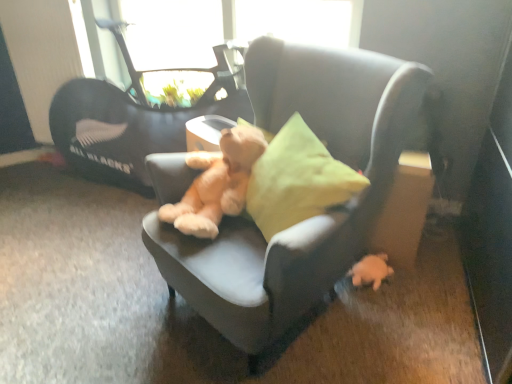
Question: Is the depth of soft beige teddy bear at center less than that of transparent glass window screen at upper center?

Choices:
 (A) no
 (B) yes

Answer: (B)

Question: Considering the relative positions of soft beige teddy bear at center and transparent glass window screen at upper center in the image provided, is soft beige teddy bear at center to the left of transparent glass window screen at upper center from the viewer's perspective?

Choices:
 (A) yes
 (B) no

Answer: (A)

Question: Can you confirm if soft beige teddy bear at center is thinner than transparent glass window screen at upper center?

Choices:
 (A) yes
 (B) no

Answer: (B)

Question: Does soft beige teddy bear at center have a smaller size compared to transparent glass window screen at upper center?

Choices:
 (A) no
 (B) yes

Answer: (B)

Question: Considering the relative positions of soft beige teddy bear at center and transparent glass window screen at upper center in the image provided, is soft beige teddy bear at center to the right of transparent glass window screen at upper center from the viewer's perspective?

Choices:
 (A) no
 (B) yes

Answer: (A)

Question: From a real-world perspective, relative to transparent glass window screen at upper center, is soft gray chair at center vertically above or below?

Choices:
 (A) below
 (B) above

Answer: (A)

Question: Is soft gray chair at center inside the boundaries of transparent glass window screen at upper center, or outside?

Choices:
 (A) inside
 (B) outside

Answer: (B)

Question: Is soft gray chair at center taller or shorter than transparent glass window screen at upper center?

Choices:
 (A) short
 (B) tall

Answer: (B)

Question: Is point (327, 269) closer or farther from the camera than point (184, 48)?

Choices:
 (A) closer
 (B) farther

Answer: (A)

Question: Is transparent glass window screen at upper center inside or outside of white plush toy at lower right?

Choices:
 (A) outside
 (B) inside

Answer: (A)

Question: Is point (350, 6) closer or farther from the camera than point (378, 266)?

Choices:
 (A) closer
 (B) farther

Answer: (B)

Question: Is transparent glass window screen at upper center wider or thinner than white plush toy at lower right?

Choices:
 (A) thin
 (B) wide

Answer: (A)

Question: Relative to white plush toy at lower right, is transparent glass window screen at upper center in front or behind?

Choices:
 (A) behind
 (B) front

Answer: (A)

Question: From a real-world perspective, relative to soft gray chair at center, is soft beige teddy bear at center vertically above or below?

Choices:
 (A) above
 (B) below

Answer: (A)

Question: In terms of height, does soft beige teddy bear at center look taller or shorter compared to soft gray chair at center?

Choices:
 (A) short
 (B) tall

Answer: (A)